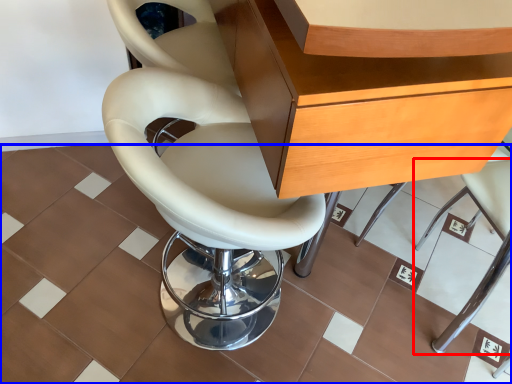
Question: Which of the following is the closest to the observer, chair (highlighted by a red box) or ceramic tile (highlighted by a blue box)?

Choices:
 (A) chair
 (B) ceramic tile

Answer: (A)